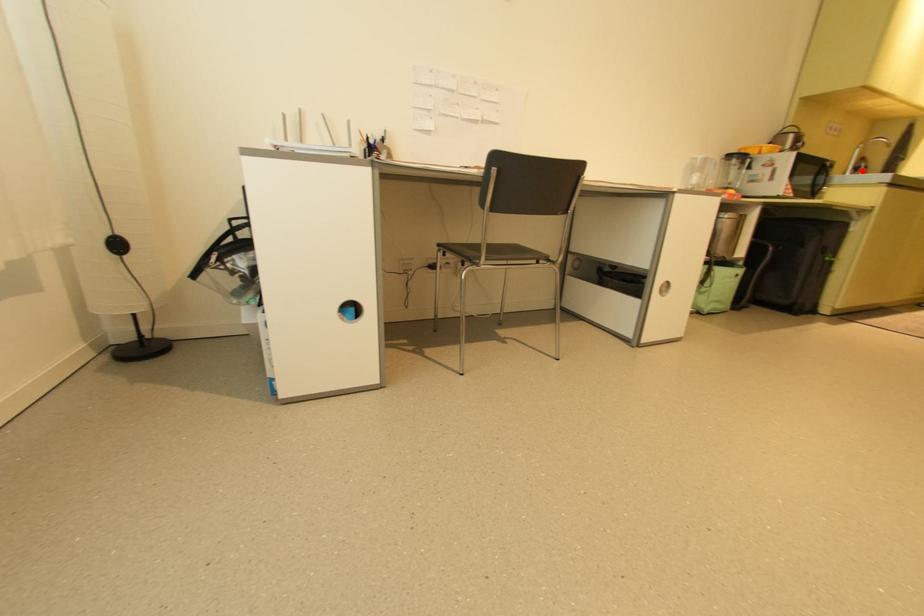
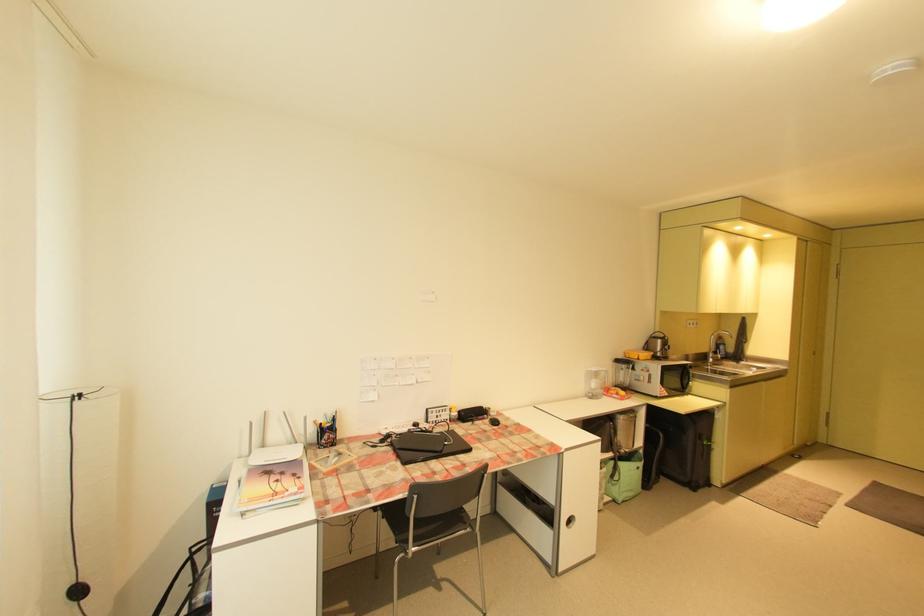
Question: I am providing you with two images of the same scene from different viewpoints. Given a red point in image1, look at the same physical point in image2. Is it:

Choices:
 (A) Closer to the viewpoint
 (B) Farther from the viewpoint

Answer: (A)